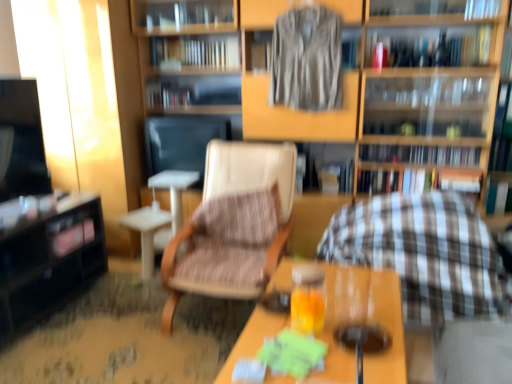
Question: Looking at their shapes, would you say striped fabric book at center, acting as the fifth book starting from the bottom, is wider or thinner than translucent glass beverage at center?

Choices:
 (A) wide
 (B) thin

Answer: (A)

Question: Does point (267, 59) appear closer or farther from the camera than point (352, 340)?

Choices:
 (A) closer
 (B) farther

Answer: (B)

Question: Which is nearer to the silky brown shirt at upper center?

Choices:
 (A) brown leather chair at center
 (B) hardcover book at center, the 6th book when ordered from top to bottom
 (C) black glossy table at left, marked as the 1th table in a back-to-front arrangement
 (D) wooden bookshelf at center
 (E) brown textured rocking chair at center

Answer: (D)

Question: Based on their relative distances, which object is nearer to the hardcover book at center, acting as the fourth book starting from the top?

Choices:
 (A) striped fabric book at center, acting as the fifth book starting from the bottom
 (B) hardcover book at upper center, acting as the first book starting from the top
 (C) silky brown shirt at upper center
 (D) hardcover book at center, the 6th book when ordered from top to bottom
 (E) hardcover book at upper right, placed as the 3th book when sorted from top to bottom

Answer: (B)